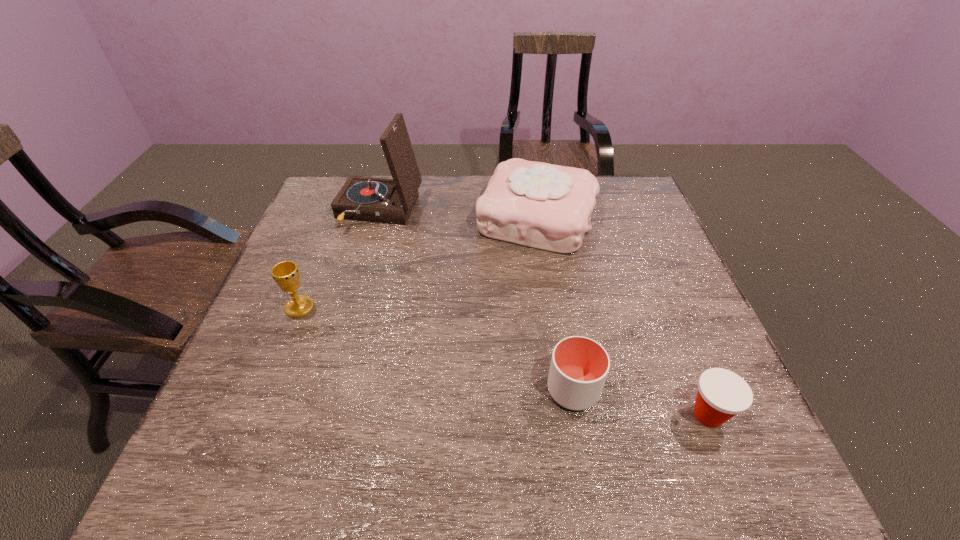
Where is `phonograph record`? This screenshot has width=960, height=540. phonograph record is located at coordinates (369, 199).

Find the location of a particular element. This screenshot has height=540, width=960. cake is located at coordinates (x=535, y=204).

At what (x,y) coordinates should I click in order to perform the action: click on chalice. Please return your answer as a coordinate pair (x, y). Looking at the image, I should click on (286, 274).

Where is `cup`? This screenshot has height=540, width=960. cup is located at coordinates (579, 366).

What are the coordinates of `the rightmost object` in the screenshot? It's located at (722, 394).

Where is `Dixie cup`? Dixie cup is located at coordinates (722, 394).

This screenshot has width=960, height=540. What are the coordinates of `vacant space located on the left of the phonograph record` in the screenshot? It's located at (315, 211).

The image size is (960, 540). I want to click on vacant region located 0.090m on the front of the cake, so click(546, 281).

The height and width of the screenshot is (540, 960). In order to click on free space located 0.310m on the front of the chalice in this screenshot , I will do `click(245, 446)`.

The image size is (960, 540). What are the coordinates of `blank area located 0.350m on the back of the cup` in the screenshot? It's located at (550, 258).